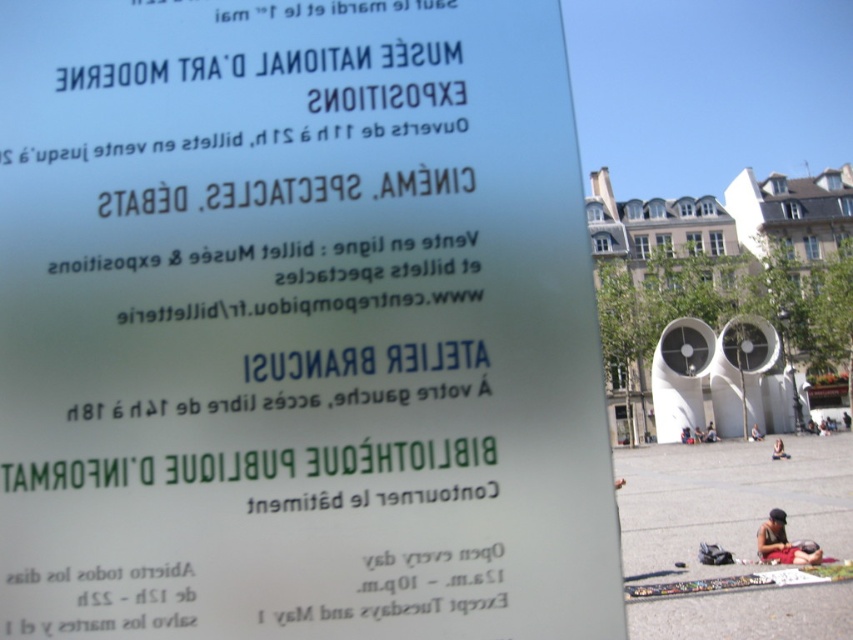
You are a tourist in Abidjan and see the dark blue fabric at center and the dark brown leather bag at lower right. Which object is nearer to you?

The dark blue fabric at center is closer to the viewer than the dark brown leather bag at lower right.

You are a traveler who just arrived in Abidjan, Ivory Coast, and you see the brown leather jacket at lower right and the dark blue jeans at lower center. Which item of clothing is smaller in size?

The brown leather jacket at lower right has a smaller size compared to the dark blue jeans at lower center.

You are a tourist in Abidjan and see the transparent glass sign at upper center and the dark blue jeans at center. Which object is smaller?

The transparent glass sign at upper center is smaller than the dark blue jeans at center.